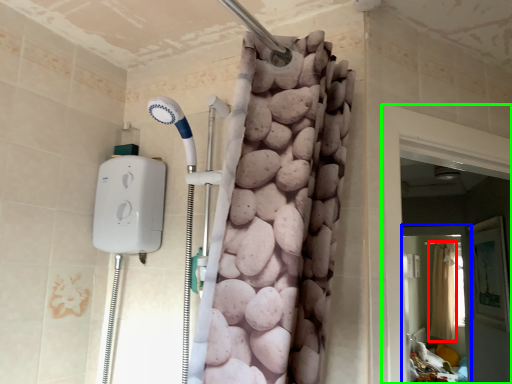
Question: Based on their relative distances, which object is farther from shower curtain (highlighted by a red box)? Choose from screen door (highlighted by a blue box) and screen door (highlighted by a green box).

Choices:
 (A) screen door
 (B) screen door

Answer: (B)